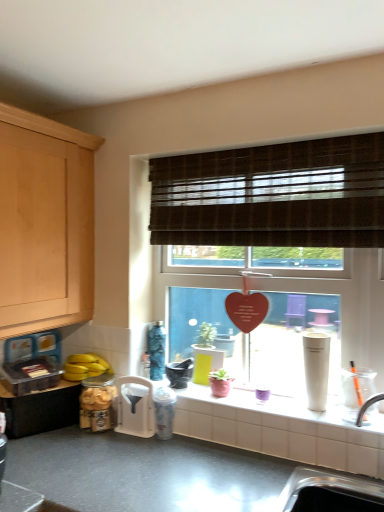
Question: From the image's perspective, is silver metallic sink at lower right beneath brown woven blind at upper center?

Choices:
 (A) no
 (B) yes

Answer: (B)

Question: From a real-world perspective, is silver metallic sink at lower right physically above brown woven blind at upper center?

Choices:
 (A) yes
 (B) no

Answer: (B)

Question: Is silver metallic sink at lower right outside of brown woven blind at upper center?

Choices:
 (A) yes
 (B) no

Answer: (A)

Question: Is silver metallic sink at lower right oriented towards brown woven blind at upper center?

Choices:
 (A) yes
 (B) no

Answer: (B)

Question: Does silver metallic sink at lower right lie in front of brown woven blind at upper center?

Choices:
 (A) no
 (B) yes

Answer: (B)

Question: Is silver metallic sink at lower right positioned with its back to brown woven blind at upper center?

Choices:
 (A) no
 (B) yes

Answer: (A)

Question: Is matte glass jar at lower left, the 1th appliance from the left, facing away from matte black mortar at center, which is the first appliance in right-to-left order?

Choices:
 (A) yes
 (B) no

Answer: (B)

Question: Is matte glass jar at lower left, which is the 3th appliance from right to left, in contact with matte black mortar at center, which is the first appliance in right-to-left order?

Choices:
 (A) yes
 (B) no

Answer: (B)

Question: Is matte glass jar at lower left, the 1th appliance from the left, not within matte black mortar at center, which is the first appliance in right-to-left order?

Choices:
 (A) no
 (B) yes

Answer: (B)

Question: Is matte glass jar at lower left, the 1th appliance from the left, wider than matte black mortar at center, which is the third appliance in left-to-right order?

Choices:
 (A) yes
 (B) no

Answer: (A)

Question: Can you confirm if matte glass jar at lower left, the 1th appliance from the left, is shorter than matte black mortar at center, which is the third appliance in left-to-right order?

Choices:
 (A) yes
 (B) no

Answer: (B)

Question: Is matte glass jar at lower left, the 1th appliance from the left, positioned before matte black mortar at center, which is the first appliance in right-to-left order?

Choices:
 (A) yes
 (B) no

Answer: (A)

Question: Can you confirm if matte black mortar at center, which is the third appliance in left-to-right order, is bigger than white plastic funnel at lower center, positioned as the second appliance in left-to-right order?

Choices:
 (A) yes
 (B) no

Answer: (B)